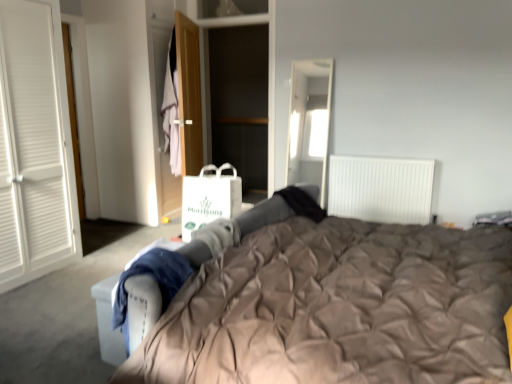
Describe the element at coordinates (381, 189) in the screenshot. The image size is (512, 384). I see `white plastic radiator at upper right` at that location.

This screenshot has width=512, height=384. I want to click on light pink fabric at center, so click(170, 110).

Find the location of a particular element. white paper shopping bag at center is located at coordinates (210, 198).

Image resolution: width=512 pixels, height=384 pixels. I want to click on radiator that is below the light pink fabric at center (from the image's perspective), so click(381, 189).

From the picture: Is white plastic radiator at upper right looking in the opposite direction of light pink fabric at center?

No, white plastic radiator at upper right's orientation is not away from light pink fabric at center.

Is there a large distance between white plastic radiator at upper right and light pink fabric at center?

Indeed, white plastic radiator at upper right is not near light pink fabric at center.

Is point (335, 171) more distant than point (170, 77)?

No.

In terms of size, does matte brown duvet at center appear bigger or smaller than white plastic radiator at upper right?

Considering their sizes, matte brown duvet at center takes up more space than white plastic radiator at upper right.

Relative to white plastic radiator at upper right, is matte brown duvet at center in front or behind?

matte brown duvet at center is positioned closer to the viewer than white plastic radiator at upper right.

Is matte brown duvet at center taller or shorter than white plastic radiator at upper right?

Considering their sizes, matte brown duvet at center has more height than white plastic radiator at upper right.

Considering the relative sizes of wooden door at center and matte brown duvet at center in the image provided, is wooden door at center shorter than matte brown duvet at center?

In fact, wooden door at center may be taller than matte brown duvet at center.

Which is less distant, (196,45) or (325,337)?

Point (196,45) appears to be farther away from the viewer than point (325,337).

Is wooden door at center smaller than matte brown duvet at center?

Yes.

Considering the positions of point (204, 44) and point (192, 151), is point (204, 44) closer or farther from the camera than point (192, 151)?

Point (204, 44) is positioned farther from the camera compared to point (192, 151).

Is dark wood cabinet at center not near wooden door at center?

They are positioned close to each other.

Locate an element on the screen. The image size is (512, 384). door in front of the dark wood cabinet at center is located at coordinates (189, 94).

Does wooden door at center come behind light pink fabric at center?

No, it is in front of light pink fabric at center.

Between wooden door at center and light pink fabric at center, which one has larger width?

With larger width is light pink fabric at center.

Based on the photo, can you confirm if wooden door at center is taller than light pink fabric at center?

Correct, wooden door at center is much taller as light pink fabric at center.

Which object is further away from the camera taking this photo, white plastic radiator at upper right or white paper shopping bag at center?

white plastic radiator at upper right is more distant.

Considering the relative sizes of white plastic radiator at upper right and white paper shopping bag at center in the image provided, is white plastic radiator at upper right wider than white paper shopping bag at center?

Incorrect, the width of white plastic radiator at upper right does not surpass that of white paper shopping bag at center.

From a real-world perspective, who is located higher, white plastic radiator at upper right or white paper shopping bag at center?

white paper shopping bag at center, from a real-world perspective.

Considering the positions of objects white plastic radiator at upper right and white paper shopping bag at center in the image provided, who is more to the right, white plastic radiator at upper right or white paper shopping bag at center?

white plastic radiator at upper right is more to the right.

Locate an element on the screen. armoire below the light pink fabric at center (from a real-world perspective) is located at coordinates (199, 51).

Can you confirm if dark wood cabinet at center is bigger than light pink fabric at center?

Yes.

Looking at this image, how many degrees apart are the facing directions of dark wood cabinet at center and light pink fabric at center?

dark wood cabinet at center and light pink fabric at center are facing 20.9 degrees away from each other.

From a real-world perspective, is dark wood cabinet at center under light pink fabric at center?

Yes, from a real-world perspective, dark wood cabinet at center is below light pink fabric at center.

You are a GUI agent. You are given a task and a screenshot of the screen. Output one action in this format:
    pyautogui.click(x=<x>, y=<y>)
    Task: Click on the radiator located in front of the light pink fabric at center
    
    Given the screenshot: What is the action you would take?
    pyautogui.click(x=381, y=189)

Find the location of a particular element. The height and width of the screenshot is (384, 512). bed positioned vertically above the white plastic radiator at upper right (from a real-world perspective) is located at coordinates 330,306.

Based on their spatial positions, is dark wood cabinet at center or light pink fabric at center closer to matte brown duvet at center?

Based on the image, light pink fabric at center appears to be nearer to matte brown duvet at center.

Considering their positions, is white paper shopping bag at center positioned closer to wooden door at center than dark wood cabinet at center?

Among the two, dark wood cabinet at center is located nearer to wooden door at center.

Considering their positions, is light pink fabric at center positioned further to wooden door at center than white plastic radiator at upper right?

white plastic radiator at upper right lies further to wooden door at center than the other object.

When comparing their distances from dark wood cabinet at center, does white paper shopping bag at center or wooden door at center seem further?

white paper shopping bag at center lies further to dark wood cabinet at center than the other object.

Considering their positions, is dark wood cabinet at center positioned further to white paper shopping bag at center than wooden door at center?

dark wood cabinet at center is further to white paper shopping bag at center.

Looking at the image, which one is located closer to dark wood cabinet at center, matte brown duvet at center or white paper shopping bag at center?

white paper shopping bag at center is positioned closer to the anchor dark wood cabinet at center.

Which object lies nearer to the anchor point dark wood cabinet at center, wooden door at center or matte brown duvet at center?

The object closer to dark wood cabinet at center is wooden door at center.

Considering their positions, is wooden door at center positioned further to matte brown duvet at center than white paper shopping bag at center?

wooden door at center is positioned further to the anchor matte brown duvet at center.

Find the location of a particular element. radiator between matte brown duvet at center and wooden door at center from front to back is located at coordinates (381, 189).

At what (x,y) coordinates should I click in order to perform the action: click on door between light pink fabric at center and white plastic radiator at upper right in the horizontal direction. Please return your answer as a coordinate pair (x, y). This screenshot has height=384, width=512. Looking at the image, I should click on (189, 94).

Find the location of a particular element. The height and width of the screenshot is (384, 512). radiator positioned between white paper shopping bag at center and dark wood cabinet at center from near to far is located at coordinates (381, 189).

This screenshot has width=512, height=384. In order to click on armoire between light pink fabric at center and white plastic radiator at upper right in this screenshot , I will do `click(199, 51)`.